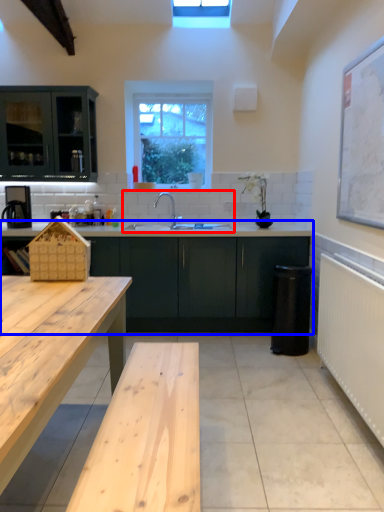
Question: Which point is closer to the camera, sink (highlighted by a red box) or cabinetry (highlighted by a blue box)?

Choices:
 (A) sink
 (B) cabinetry

Answer: (B)